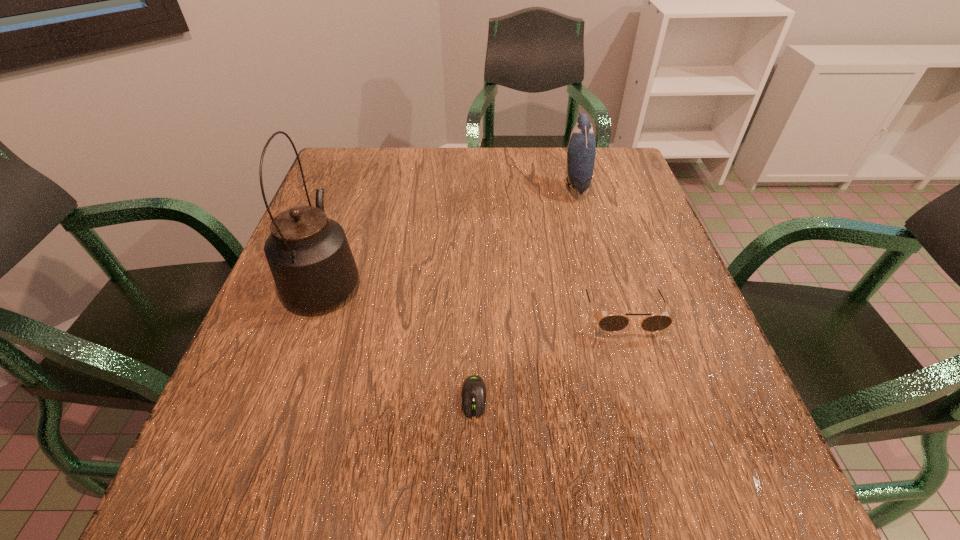
Where is `the leftmost object`? The width and height of the screenshot is (960, 540). the leftmost object is located at coordinates click(309, 256).

Locate an element on the screen. the tallest object is located at coordinates (309, 256).

Locate an element on the screen. Image resolution: width=960 pixels, height=540 pixels. the third shortest object is located at coordinates (581, 150).

Find the location of a particular element. The height and width of the screenshot is (540, 960). bird is located at coordinates (581, 150).

Find the location of a particular element. sunglasses is located at coordinates (612, 323).

Find the location of a particular element. The height and width of the screenshot is (540, 960). the second object from left to right is located at coordinates (473, 394).

The width and height of the screenshot is (960, 540). I want to click on computer mouse, so click(473, 394).

This screenshot has height=540, width=960. Find the location of `vacant space located 0.050m spout on the leftmost object`. vacant space located 0.050m spout on the leftmost object is located at coordinates click(x=342, y=231).

You are a GUI agent. You are given a task and a screenshot of the screen. Output one action in this format:
    pyautogui.click(x=<x>, y=<y>)
    Task: Click on the vacant space located 0.240m spout on the leftmost object
    
    Given the screenshot: What is the action you would take?
    pyautogui.click(x=357, y=188)

In order to click on vacant area situated spout on the leftmost object in this screenshot , I will do `click(352, 201)`.